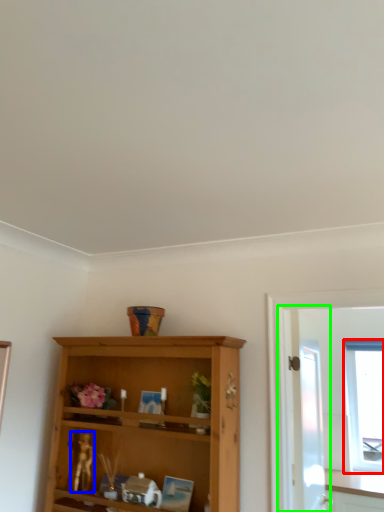
Question: Based on their relative distances, which object is farther from window (highlighted by a red box)? Choose from miniature (highlighted by a blue box) and screen door (highlighted by a green box).

Choices:
 (A) miniature
 (B) screen door

Answer: (A)